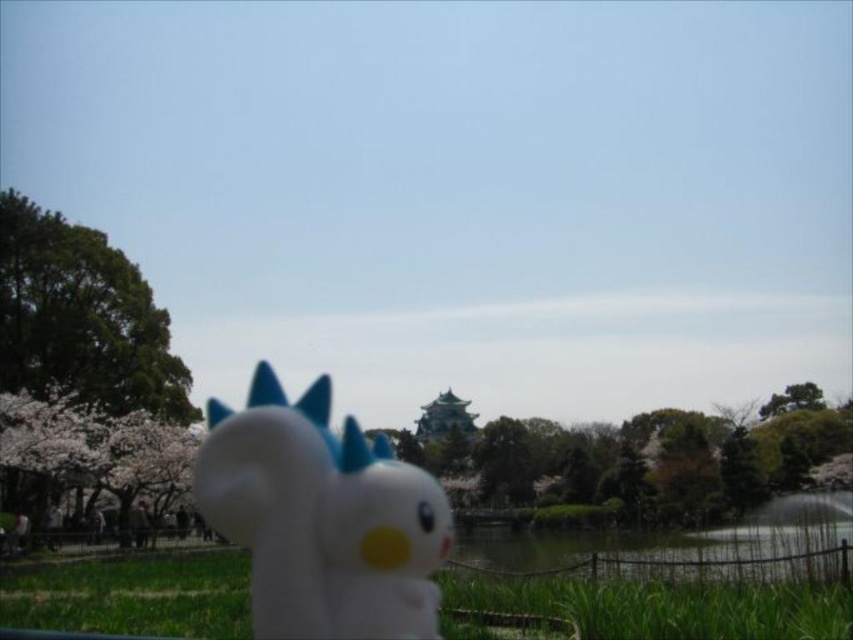
You are a photographer who wants to capture a closeup of the white matte plush toy at center and the green grass at lower center. Which object should you focus on if you want the plush toy to be in sharp focus while the grass is slightly blurred?

You should focus on the white matte plush toy at center because it is closer to the viewer than the green grass at lower center. Since it is closer, focusing on it will keep it sharp while the background elements like the green grass at lower center may appear blurred.

You are a photographer who wants to capture a closeup of the white matte plush toy at center and the green grass at lower center. Which object is closer to the left edge of the frame?

The white matte plush toy at center is positioned on the left side of green grass at lower center, so it is closer to the left edge of the frame.

You are a photographer standing at the edge of the pond. You want to place a small camera tripod between the white matte plush toy at center and the green grass at lower center. If the tripod requires 1 meter of space between the two objects to be placed safely, can you position it there?

The white matte plush toy at center is 11.35 meters away from the green grass at lower center. Since the required space for the tripod is only 1 meter, there is ample space to place the tripod between them.